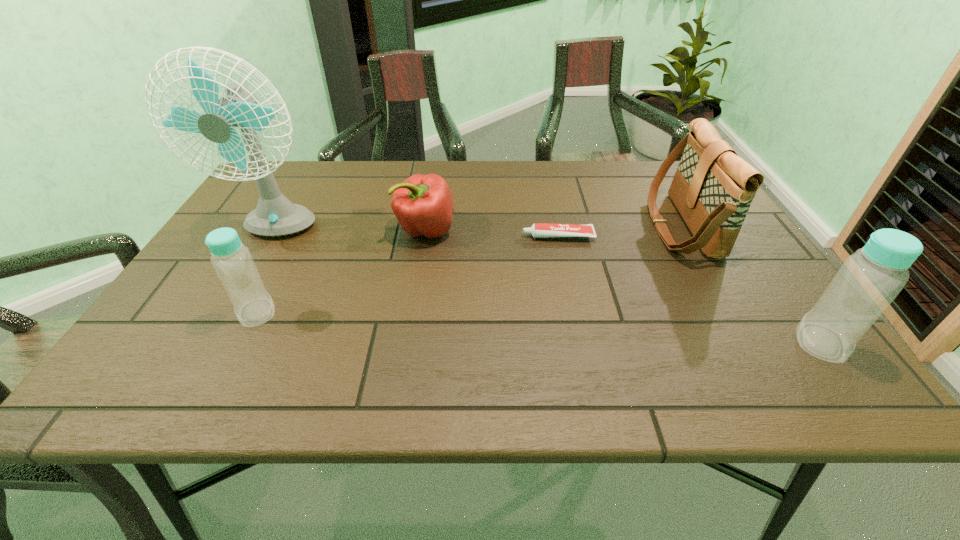
Where is `vacant region at the left edge of the desktop`? vacant region at the left edge of the desktop is located at coordinates (252, 204).

You are a GUI agent. You are given a task and a screenshot of the screen. Output one action in this format:
    pyautogui.click(x=<x>, y=<y>)
    Task: Click on the vacant area at the right edge
    The image size is (960, 540).
    Given the screenshot: What is the action you would take?
    pyautogui.click(x=673, y=227)

Locate an element on the screen. This screenshot has width=960, height=540. free space that is in between the fan and the right bottle is located at coordinates (548, 286).

The height and width of the screenshot is (540, 960). Identify the location of free spot between the bell pepper and the right bottle. click(x=623, y=286).

Find the location of a particular element. Image resolution: width=960 pixels, height=540 pixels. vacant area that lies between the shorter bottle and the fifth tallest object is located at coordinates (341, 271).

This screenshot has width=960, height=540. I want to click on vacant space in between the taller bottle and the bell pepper, so click(x=623, y=286).

Locate an element on the screen. The height and width of the screenshot is (540, 960). empty space between the fourth tallest object and the bell pepper is located at coordinates (341, 271).

Locate an element on the screen. free space between the shorter bottle and the second object from right to left is located at coordinates (468, 269).

At what (x,y) coordinates should I click in order to perform the action: click on free spot between the right bottle and the fifth tallest object. Please return your answer as a coordinate pair (x, y). The height and width of the screenshot is (540, 960). Looking at the image, I should click on (623, 286).

Identify the location of free spot between the shoulder bag and the fourth tallest object. Image resolution: width=960 pixels, height=540 pixels. (468, 269).